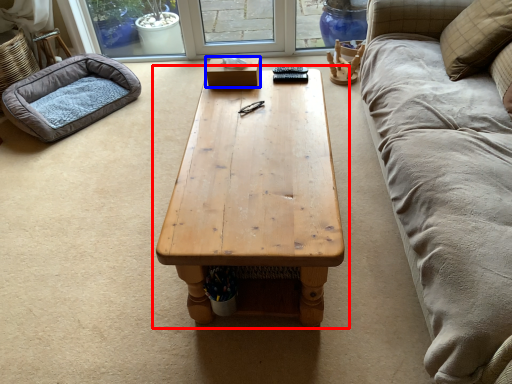
Question: Which of the following is the farthest to the observer, coffee table (highlighted by a red box) or box (highlighted by a blue box)?

Choices:
 (A) coffee table
 (B) box

Answer: (B)